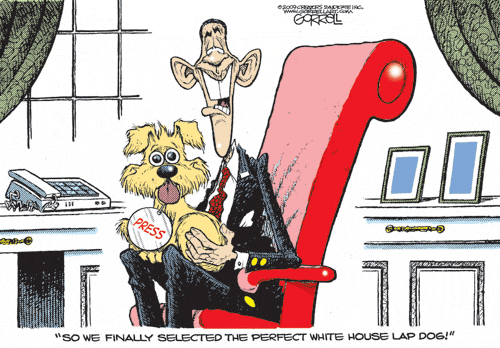
This screenshot has width=500, height=348. In order to click on windows in this screenshot , I will do `click(92, 64)`, `click(51, 71)`, `click(53, 127)`, `click(96, 111)`, `click(101, 18)`, `click(11, 132)`.